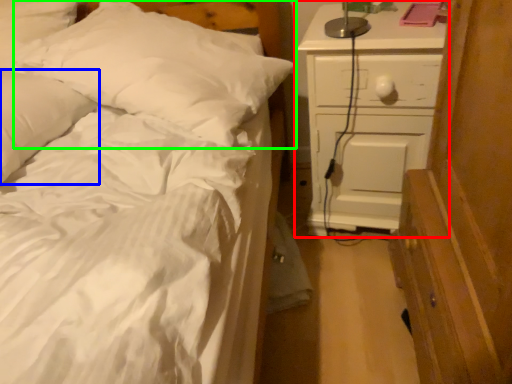
Question: Which object is positioned farthest from chest of drawers (highlighted by a red box)? Select from pillow (highlighted by a blue box) and pillow (highlighted by a green box).

Choices:
 (A) pillow
 (B) pillow

Answer: (A)